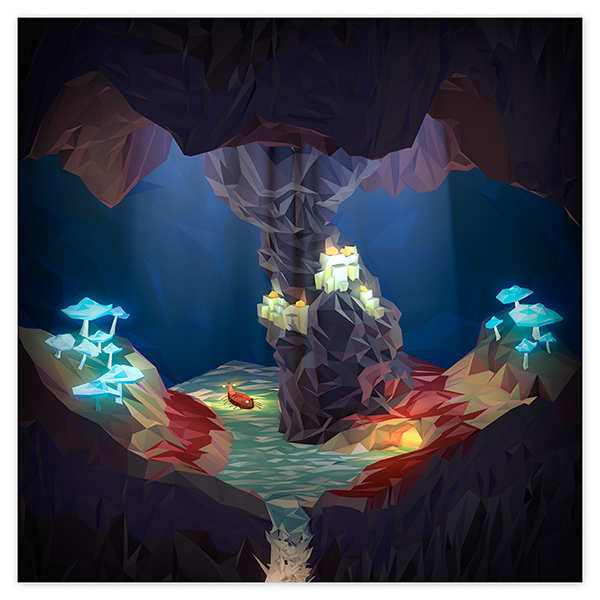
Locate an element on the screen. ceiling is located at coordinates (183, 108), (300, 103), (410, 99), (488, 124), (127, 152).